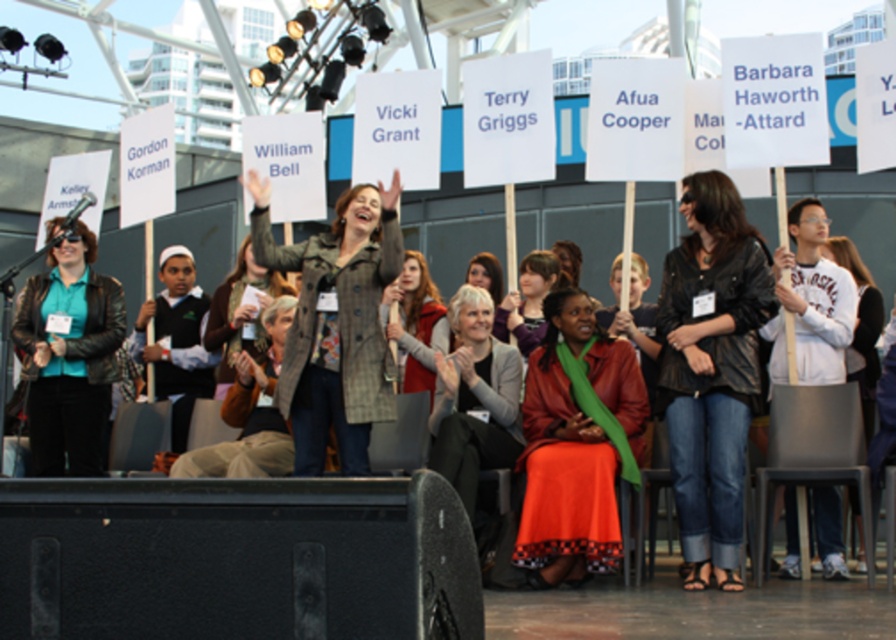
You are standing at the point with coordinates point (849, 241) and want to walk to point (119, 333). Is there a clear path between these two points without any obstacles?

Point (119, 333) is behind point (849, 241), so there might be an obstacle blocking the path between them. You might need to go around.

You are an event organizer who needs to arrange a photo shoot for the participants. You notice two coats hanging on the same rack at the center of the stage. Which coat is more visible to the photographer standing at the back of the room? The coats are the leather jacket at center and the plaid wool coat at center.

The leather jacket at center is more visible because it is in front of the plaid wool coat at center.